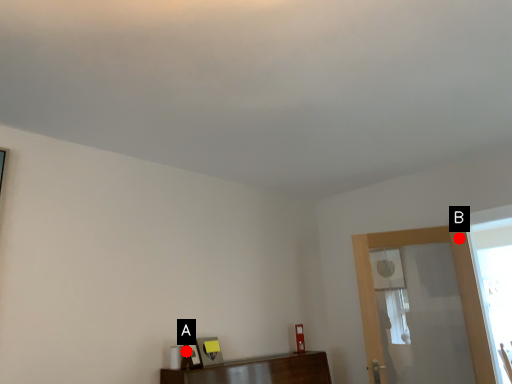
Question: Two points are circled on the image, labeled by A and B beside each circle. Which point is farther to the camera?

Choices:
 (A) A is further
 (B) B is further

Answer: (B)